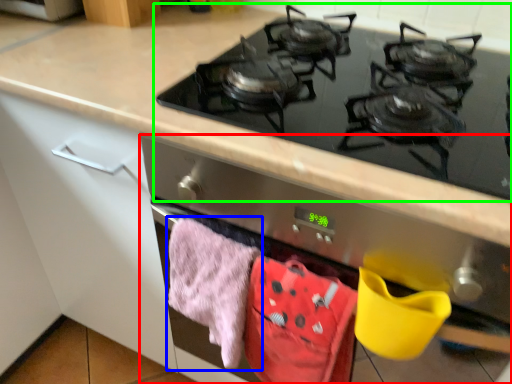
Question: Estimate the real-world distances between objects in this image. Which object is farther from oven (highlighted by a red box), beach towel (highlighted by a blue box) or gas stove (highlighted by a green box)?

Choices:
 (A) beach towel
 (B) gas stove

Answer: (B)